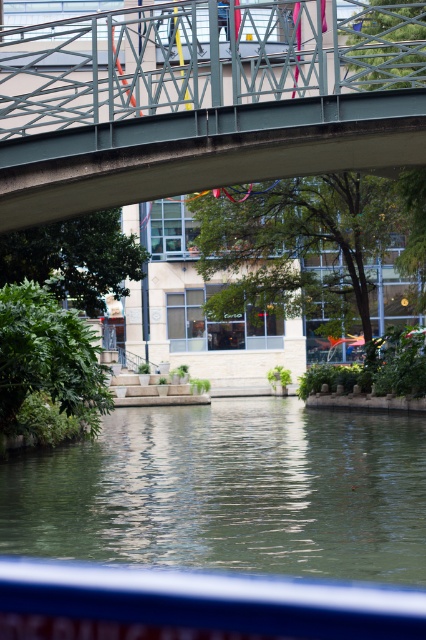
Measure the distance from metallic gray bridge at upper center to green smooth water at center.

metallic gray bridge at upper center and green smooth water at center are 7.00 meters apart from each other.

Is metallic gray bridge at upper center to the left of green smooth water at center from the viewer's perspective?

Indeed, metallic gray bridge at upper center is positioned on the left side of green smooth water at center.

This screenshot has height=640, width=426. What do you see at coordinates (198, 99) in the screenshot?
I see `metallic gray bridge at upper center` at bounding box center [198, 99].

This screenshot has height=640, width=426. Identify the location of metallic gray bridge at upper center. (198, 99).